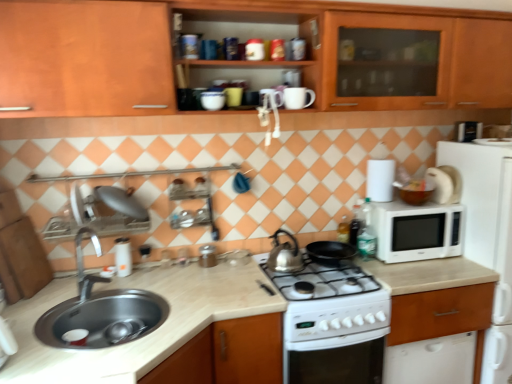
Where is `vacant area that is in front of white matte microwave at right`? The image size is (512, 384). vacant area that is in front of white matte microwave at right is located at coordinates point(426,268).